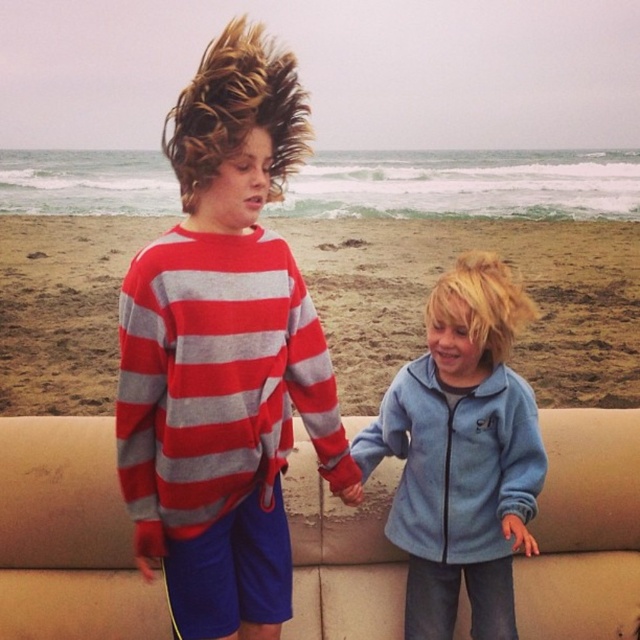
You are planning to host a small gathering on the beach. You have a beige fabric couch at center and a light blue fleece jacket at center. Which object would be more suitable for seating guests, and why?

The beige fabric couch at center is more suitable for seating guests because it occupies less space than the light blue fleece jacket at center, making it easier to accommodate more people in the limited beach area.

You are a photographer trying to capture both children in a single frame. Given that the red and gray striped sweater at center and the light blue fleece jacket at center are both in the center, which clothing item should you focus on to ensure both children are fully visible in the photo?

Since the red and gray striped sweater at center takes up less space than the light blue fleece jacket at center, focusing on the red and gray striped sweater at center would allow the photographer to adjust the frame to include both children without cropping out either.

Consider the image. You are a photographer standing at the beach. You want to take a photo that includes both the point at coordinates point (164, 225) and point (417, 394). Which point should you focus on first to ensure both are in focus?

You should focus on point (164, 225) first because it is closer to the camera than point (417, 394). By focusing on the closer point, the farther point will also be within the depth of field.